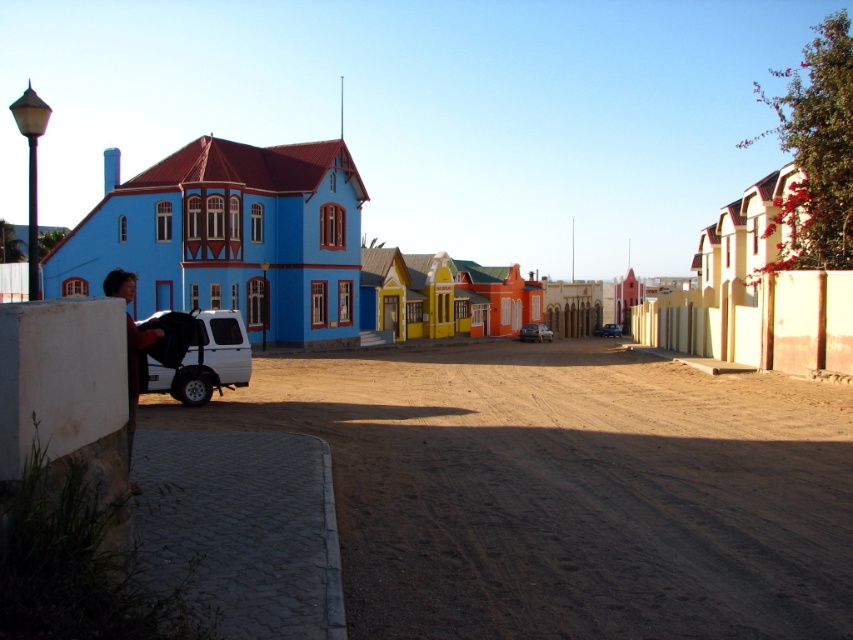
Does metallic silver car at center appear on the right side of matte black car at center?

In fact, metallic silver car at center is to the left of matte black car at center.

Is point (535, 340) positioned before point (613, 332)?

That is True.

Which is in front, point (527, 330) or point (595, 332)?

Positioned in front is point (527, 330).

The image size is (853, 640). What are the coordinates of `metallic silver car at center` in the screenshot? It's located at (534, 332).

In the scene shown: Is brown sandy dirt track at lower left to the right of black fabric baby carriage at lower left from the viewer's perspective?

Yes, brown sandy dirt track at lower left is to the right of black fabric baby carriage at lower left.

The width and height of the screenshot is (853, 640). What do you see at coordinates (566, 490) in the screenshot? I see `brown sandy dirt track at lower left` at bounding box center [566, 490].

What do you see at coordinates (566, 490) in the screenshot? This screenshot has width=853, height=640. I see `brown sandy dirt track at lower left` at bounding box center [566, 490].

At what (x,y) coordinates should I click in order to perform the action: click on brown sandy dirt track at lower left. Please return your answer as a coordinate pair (x, y). Looking at the image, I should click on (566, 490).

Which is more to the right, brown sandy dirt track at lower left or metallic silver car at center?

metallic silver car at center is more to the right.

Who is lower down, brown sandy dirt track at lower left or metallic silver car at center?

Positioned lower is brown sandy dirt track at lower left.

You are a GUI agent. You are given a task and a screenshot of the screen. Output one action in this format:
    pyautogui.click(x=<x>, y=<y>)
    Task: Click on the brown sandy dirt track at lower left
    The width and height of the screenshot is (853, 640).
    Given the screenshot: What is the action you would take?
    pyautogui.click(x=566, y=490)